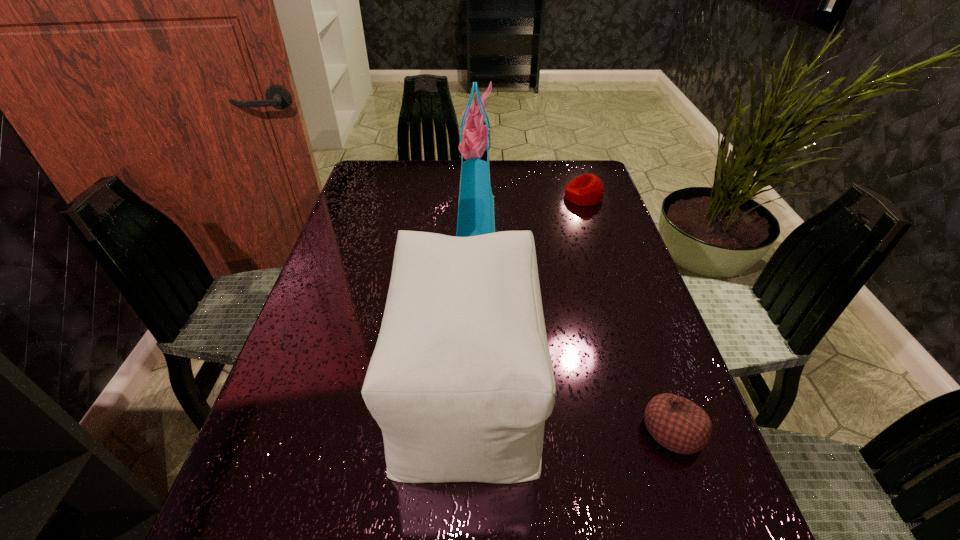
Where is `the tallest object`? the tallest object is located at coordinates (476, 217).

In order to click on cushion in this screenshot , I will do `click(461, 381)`.

Where is `the farther beanbag`? the farther beanbag is located at coordinates (586, 190).

Locate an element on the screen. the nearer beanbag is located at coordinates (676, 423).

Where is `vacant space located 0.180m on the right of the tallest object`? This screenshot has width=960, height=540. vacant space located 0.180m on the right of the tallest object is located at coordinates (558, 218).

Locate an element on the screen. vacant space located on the side of the cushion with the smiley face is located at coordinates (581, 387).

You are a GUI agent. You are given a task and a screenshot of the screen. Output one action in this format:
    pyautogui.click(x=<x>, y=<y>)
    Task: Click on the vacant space situated on the seat area of the farther beanbag
    This screenshot has width=960, height=540.
    Given the screenshot: What is the action you would take?
    pyautogui.click(x=450, y=197)

You are a GUI agent. You are given a task and a screenshot of the screen. Output one action in this format:
    pyautogui.click(x=<x>, y=<y>)
    Task: Click on the blank space located on the seat area of the farther beanbag
    
    Given the screenshot: What is the action you would take?
    pyautogui.click(x=539, y=197)

Identify the location of free space located on the seat area of the farther beanbag. (434, 197).

The width and height of the screenshot is (960, 540). What are the coordinates of `free space located 0.360m on the back of the nearer beanbag` in the screenshot? It's located at (618, 274).